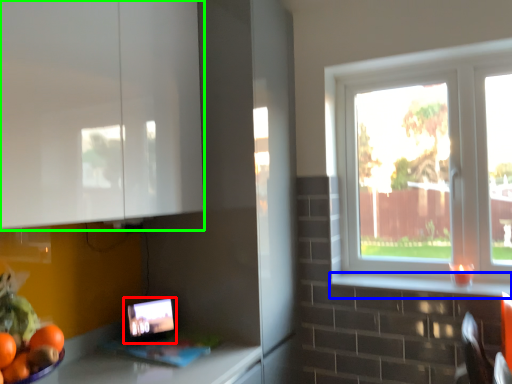
Question: Based on their relative distances, which object is farther from tablet computer (highlighted by a red box)? Choose from window sill (highlighted by a blue box) and cabinetry (highlighted by a green box).

Choices:
 (A) window sill
 (B) cabinetry

Answer: (A)